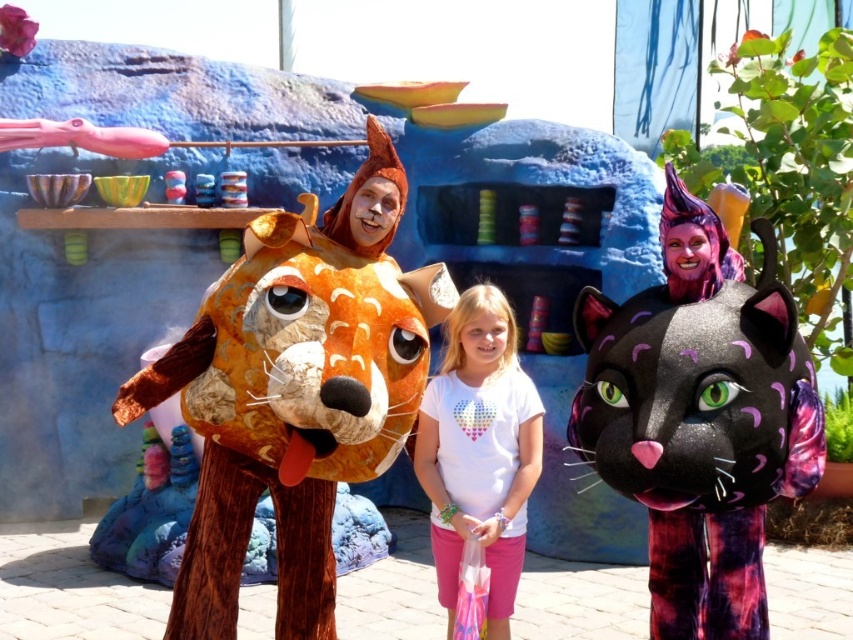
Does wooden textured fox head at center have a lesser height compared to white cotton t-shirt at center?

In fact, wooden textured fox head at center may be taller than white cotton t-shirt at center.

Which is behind, point (254, 467) or point (450, 442)?

Positioned behind is point (450, 442).

Between point (283, 513) and point (495, 403), which one is positioned in front?

Point (495, 403)

The image size is (853, 640). Find the location of `wooden textured fox head at center`. wooden textured fox head at center is located at coordinates (289, 412).

Which is more to the left, wooden textured fox head at center or black furry cat at right?

wooden textured fox head at center is more to the left.

The width and height of the screenshot is (853, 640). What do you see at coordinates (289, 412) in the screenshot?
I see `wooden textured fox head at center` at bounding box center [289, 412].

The width and height of the screenshot is (853, 640). In order to click on wooden textured fox head at center in this screenshot , I will do `click(289, 412)`.

Does black furry cat at right have a lesser height compared to white cotton t-shirt at center?

Incorrect, black furry cat at right's height does not fall short of white cotton t-shirt at center's.

Looking at this image, which of these two, black furry cat at right or white cotton t-shirt at center, stands taller?

Standing taller between the two is black furry cat at right.

Where is `black furry cat at right`? black furry cat at right is located at coordinates (700, 422).